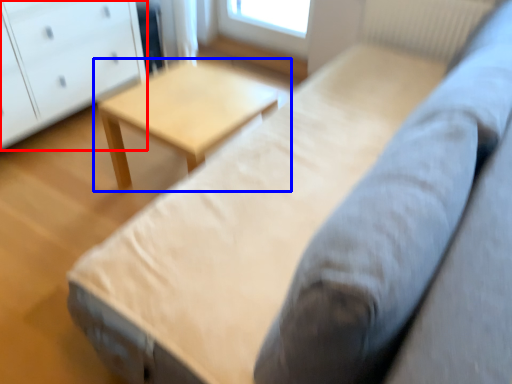
Question: Among these objects, which one is farthest to the camera, chest of drawers (highlighted by a red box) or table (highlighted by a blue box)?

Choices:
 (A) chest of drawers
 (B) table

Answer: (A)